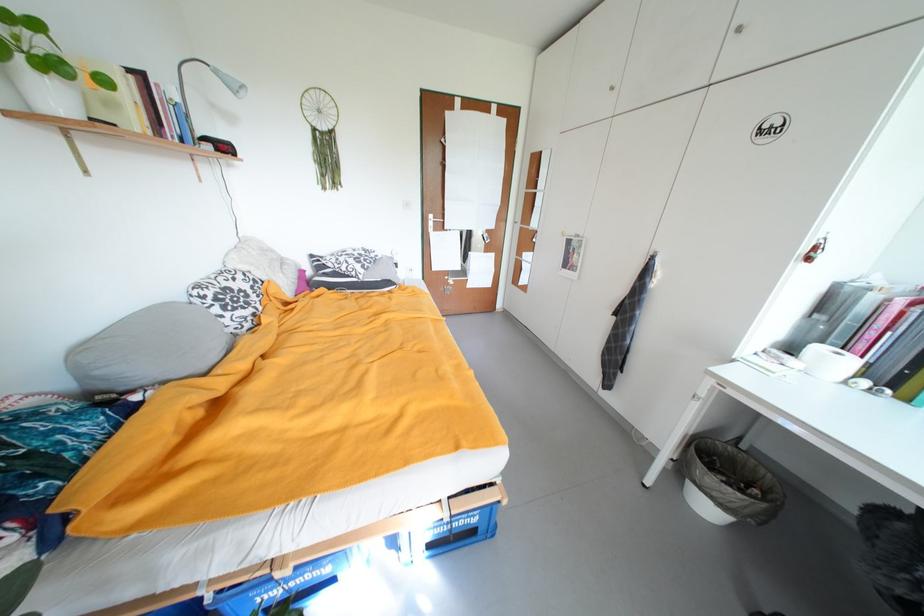
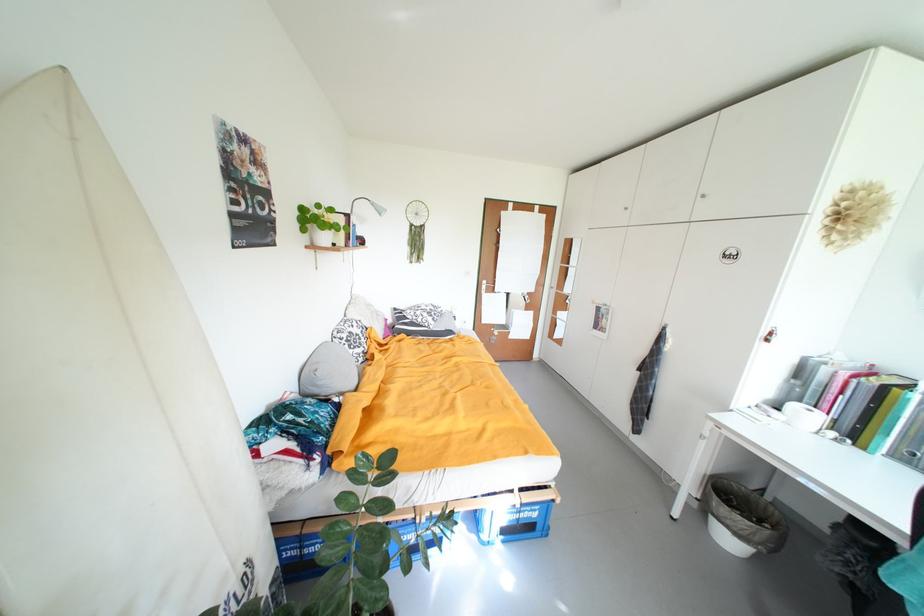
The point at (842, 363) is marked in the first image. Where is the corresponding point in the second image?

(817, 419)